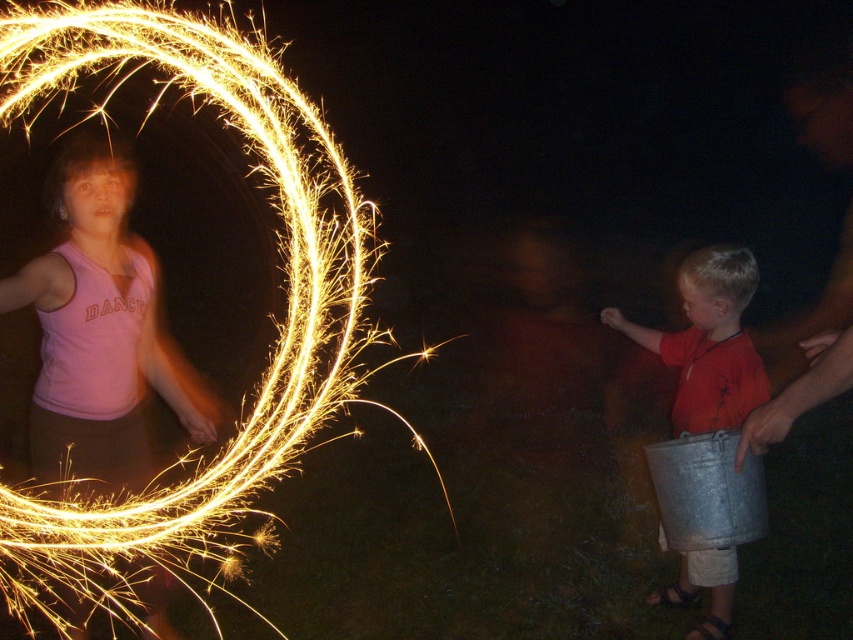
Question: Which point is farther to the camera?

Choices:
 (A) (300, 106)
 (B) (730, 349)

Answer: (A)

Question: Which point is farther to the camera?

Choices:
 (A) bright metallic sparkler at upper left
 (B) metallic bucket at right

Answer: (B)

Question: Can you confirm if bright metallic sparkler at upper left is thinner than metallic bucket at right?

Choices:
 (A) no
 (B) yes

Answer: (A)

Question: Can you confirm if bright metallic sparkler at upper left is positioned above metallic bucket at right?

Choices:
 (A) yes
 (B) no

Answer: (A)

Question: Which point is farther to the camera?

Choices:
 (A) (706, 552)
 (B) (334, 180)

Answer: (B)

Question: Does bright metallic sparkler at upper left appear under metallic bucket at right?

Choices:
 (A) yes
 (B) no

Answer: (B)